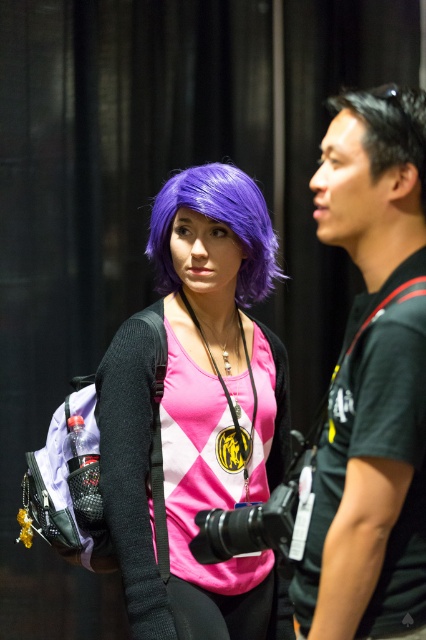
Between point (186, 545) and point (417, 99), which one is positioned in front?

Point (417, 99)

How far apart are purple matte wig at center and black shiny hair at upper right?

purple matte wig at center and black shiny hair at upper right are 30.86 inches apart from each other.

Who is more distant from viewer, (181, 241) or (385, 104)?

Point (181, 241)

This screenshot has height=640, width=426. What are the coordinates of `purple matte wig at center` in the screenshot? It's located at (198, 412).

Is the position of black matte shirt at right more distant than that of black shiny hair at upper right?

No, black matte shirt at right is closer to the viewer.

Who is more forward, (417, 163) or (422, 180)?

Positioned in front is point (417, 163).

From the picture: Who is more forward, (350,161) or (396,145)?

Positioned in front is point (396,145).

You are a GUI agent. You are given a task and a screenshot of the screen. Output one action in this format:
    pyautogui.click(x=<x>, y=<y>)
    Task: Click on the black matte shirt at right
    
    Given the screenshot: What is the action you would take?
    pyautogui.click(x=371, y=380)

Can you confirm if black matte shirt at right is wider than purple synthetic wig at center?

Incorrect, black matte shirt at right's width does not surpass purple synthetic wig at center's.

Who is positioned more to the right, black matte shirt at right or purple synthetic wig at center?

From the viewer's perspective, black matte shirt at right appears more on the right side.

Who is more distant from viewer, [423,445] or [161,234]?

The point [161,234] is more distant.

Find the location of `black matte shirt at right`. black matte shirt at right is located at coordinates (371, 380).